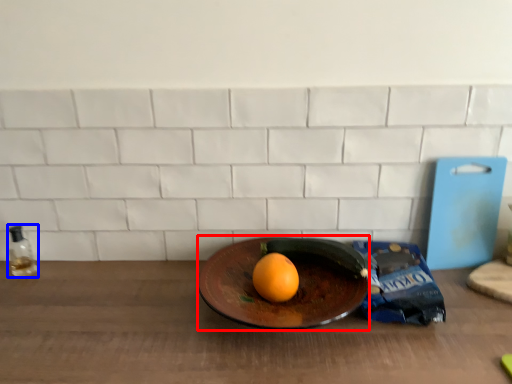
Question: Which point is closer to the camera, plate (highlighted by a red box) or bottle (highlighted by a blue box)?

Choices:
 (A) plate
 (B) bottle

Answer: (A)